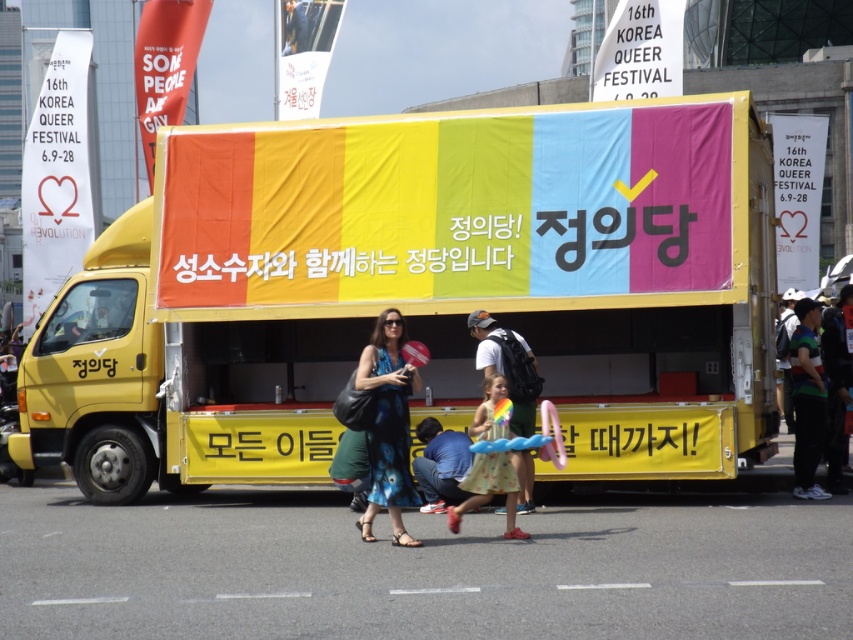
Who is more distant from viewer, [345,218] or [430,508]?

The point [345,218] is behind.

Does yellow matte truck at center have a smaller size compared to blue denim jeans at lower center?

Incorrect, yellow matte truck at center is not smaller in size than blue denim jeans at lower center.

Identify the location of yellow matte truck at center. (419, 291).

Locate an element on the screen. The width and height of the screenshot is (853, 640). yellow matte truck at center is located at coordinates (419, 291).

Can you confirm if blue tie-dye dress at center is shorter than yellow floral dress at center?

Incorrect, blue tie-dye dress at center's height does not fall short of yellow floral dress at center's.

Which is behind, point (405, 454) or point (498, 374)?

Positioned behind is point (498, 374).

Is point (379, 449) closer to viewer compared to point (514, 513)?

Yes, it is.

Identify the location of blue tie-dye dress at center. The height and width of the screenshot is (640, 853). (387, 426).

Which of these two, striped fabric shirt at right or white cotton backpack at center, stands taller?

striped fabric shirt at right

Is striped fabric shirt at right taller than white cotton backpack at center?

Indeed, striped fabric shirt at right has a greater height compared to white cotton backpack at center.

Does point (809, 406) lie in front of point (526, 349)?

That is False.

Where is `striped fabric shirt at right`? This screenshot has height=640, width=853. striped fabric shirt at right is located at coordinates (807, 400).